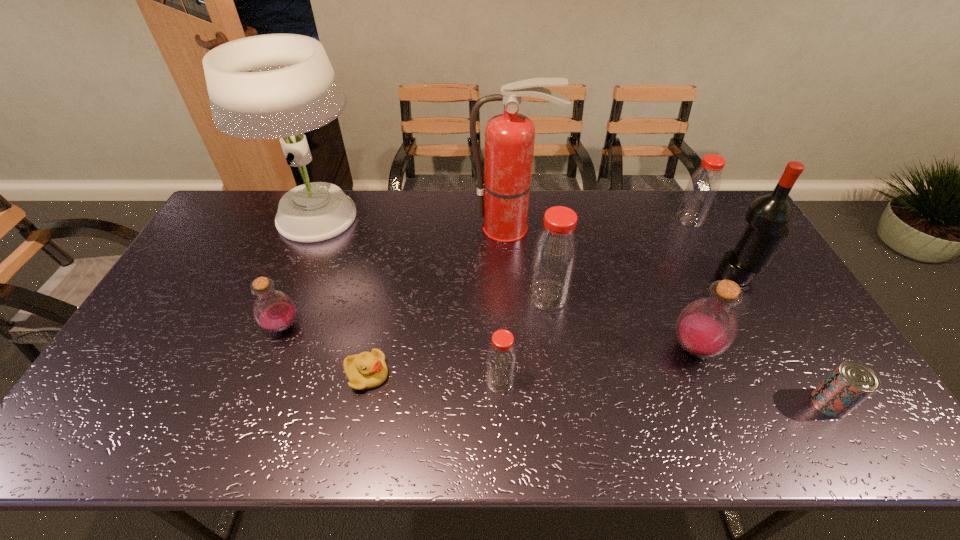
The image size is (960, 540). Identify the location of the nearest red bottle. (501, 359).

This screenshot has height=540, width=960. Identify the location of the fourth bottle from right to left. coord(501,359).

The image size is (960, 540). I want to click on the smaller purple bottle, so click(x=274, y=311).

This screenshot has width=960, height=540. In order to click on the left purple bottle in this screenshot , I will do `click(274, 311)`.

The image size is (960, 540). I want to click on the second shortest object, so click(x=850, y=383).

This screenshot has width=960, height=540. In order to click on red beer can in this screenshot , I will do `click(850, 383)`.

Locate an element on the screen. This screenshot has width=960, height=540. the eighth object from right to left is located at coordinates (366, 370).

The image size is (960, 540). I want to click on the shortest object, so click(x=366, y=370).

Where is `free space located on the front-facing side of the white lamp`? free space located on the front-facing side of the white lamp is located at coordinates (401, 219).

Locate an element on the screen. The height and width of the screenshot is (540, 960). free space located with the handle and hose on the fire extinguisher is located at coordinates (515, 264).